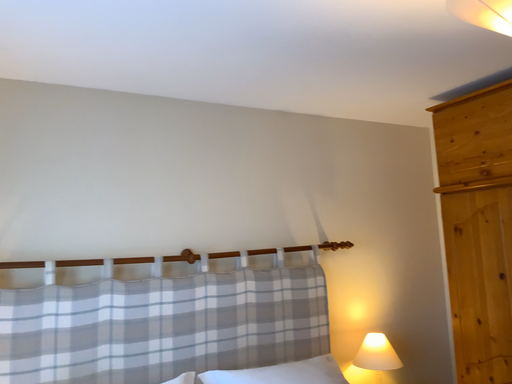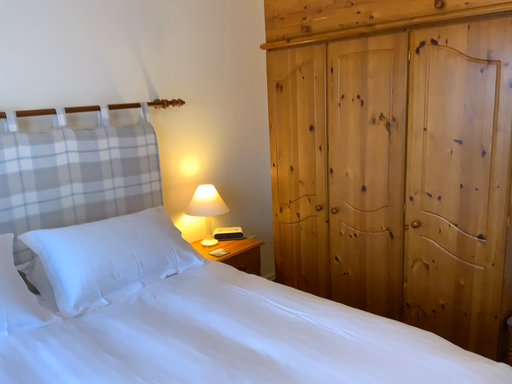
Question: Which way did the camera rotate in the video?

Choices:
 (A) rotated upward
 (B) rotated downward

Answer: (B)